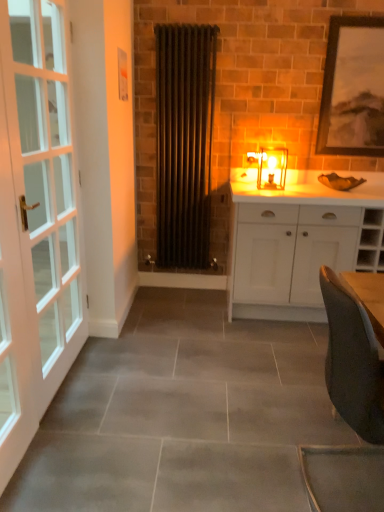
Question: Is point (203, 151) positioned closer to the camera than point (364, 75)?

Choices:
 (A) farther
 (B) closer

Answer: (A)

Question: Considering their positions, is matte black radiator at center located in front of or behind black matte picture frame at upper right?

Choices:
 (A) behind
 (B) front

Answer: (B)

Question: Estimate the real-world distances between objects in this image. Which object is farther from the black matte picture frame at upper right?

Choices:
 (A) matte glass candlestick at center
 (B) white matte cabinet at center
 (C) white glass door at left
 (D) matte black radiator at center

Answer: (C)

Question: Estimate the real-world distances between objects in this image. Which object is farther from the matte glass candlestick at center?

Choices:
 (A) matte black radiator at center
 (B) white glass door at left
 (C) black matte picture frame at upper right
 (D) white matte cabinet at center

Answer: (B)